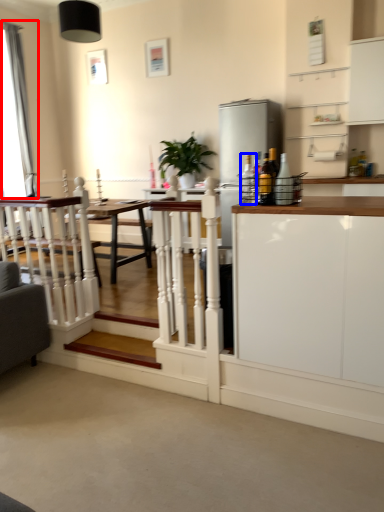
Question: Among these objects, which one is farthest to the camera, curtain (highlighted by a red box) or bottle (highlighted by a blue box)?

Choices:
 (A) curtain
 (B) bottle

Answer: (A)